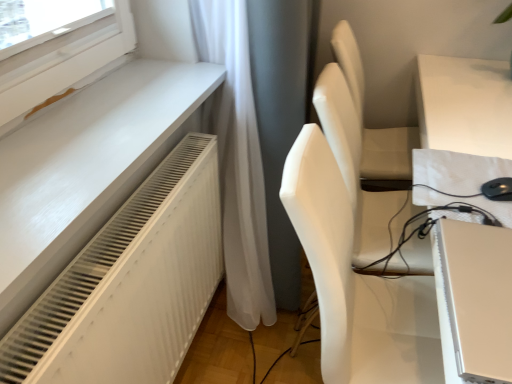
This screenshot has width=512, height=384. What do you see at coordinates (130, 284) in the screenshot?
I see `white textured radiator at lower left` at bounding box center [130, 284].

Where is `satin gold laptop at lower right`? satin gold laptop at lower right is located at coordinates (478, 297).

I want to click on white textured radiator at lower left, so click(130, 284).

Identify the location of computer on the right of the white textured radiator at lower left. The height and width of the screenshot is (384, 512). (478, 297).

From the image's perspective, between satin gold laptop at lower right and white textured radiator at lower left, who is located below?

satin gold laptop at lower right is shown below in the image.

Looking at this image, is satin gold laptop at lower right oriented towards white textured radiator at lower left?

No, satin gold laptop at lower right is not aimed at white textured radiator at lower left.

Is satin gold laptop at lower right not within white textured radiator at lower left?

satin gold laptop at lower right lies outside white textured radiator at lower left's area.

Considering the sizes of objects white textured radiator at lower left and white matte chair at center in the image provided, who is bigger, white textured radiator at lower left or white matte chair at center?

With larger size is white matte chair at center.

Is white textured radiator at lower left located outside white matte chair at center?

white textured radiator at lower left is positioned outside white matte chair at center.

Is white textured radiator at lower left turned away from white matte chair at center?

white textured radiator at lower left is not turned away from white matte chair at center.

At what (x,y) coordinates should I click in order to perform the action: click on radiator in front of the white matte chair at center. Please return your answer as a coordinate pair (x, y). The width and height of the screenshot is (512, 384). Looking at the image, I should click on (130, 284).

How far apart are white matte chair at center and matte white table at right?

white matte chair at center is 23.99 inches away from matte white table at right.

Find the location of a particular element. table beneath the white matte chair at center (from a real-world perspective) is located at coordinates (464, 105).

From the picture: Does white matte chair at center contain matte white table at right?

No, matte white table at right is not surrounded by white matte chair at center.

In the scene shown: Does white matte chair at center have a lesser width compared to matte white table at right?

Yes, white matte chair at center is thinner than matte white table at right.

Does white matte chair at center have a lesser height compared to satin gold laptop at lower right?

Incorrect, the height of white matte chair at center does not fall short of that of satin gold laptop at lower right.

Considering the relative positions of white matte chair at center and satin gold laptop at lower right in the image provided, is white matte chair at center to the left or to the right of satin gold laptop at lower right?

Based on their positions, white matte chair at center is located to the left of satin gold laptop at lower right.

From a real-world perspective, which is physically below, white matte chair at center or satin gold laptop at lower right?

In real-world perspective, white matte chair at center is lower.

The image size is (512, 384). There is a satin gold laptop at lower right. Identify the location of radiator above it (from a real-world perspective). (130, 284).

Is white textured radiator at lower left situated inside satin gold laptop at lower right or outside?

white textured radiator at lower left is spatially situated outside satin gold laptop at lower right.

From the image's perspective, which is above, white textured radiator at lower left or satin gold laptop at lower right?

white textured radiator at lower left, from the image's perspective.

Does white textured radiator at lower left have a greater height compared to satin gold laptop at lower right?

Yes, white textured radiator at lower left is taller than satin gold laptop at lower right.

Looking at their sizes, would you say white textured radiator at lower left is wider or thinner than matte white table at right?

Considering their sizes, white textured radiator at lower left looks slimmer than matte white table at right.

Which of these two, white textured radiator at lower left or matte white table at right, is bigger?

matte white table at right.

The height and width of the screenshot is (384, 512). I want to click on radiator on the left of matte white table at right, so click(x=130, y=284).

Based on their positions, is white textured radiator at lower left located to the left or right of matte white table at right?

white textured radiator at lower left is to the left of matte white table at right.

Consider the image. Which of these two, satin gold laptop at lower right or white matte chair at center, stands shorter?

satin gold laptop at lower right is shorter.

Is satin gold laptop at lower right situated inside white matte chair at center or outside?

satin gold laptop at lower right lies within the bounds of white matte chair at center.

Considering the positions of objects satin gold laptop at lower right and white matte chair at center in the image provided, who is more to the left, satin gold laptop at lower right or white matte chair at center?

white matte chair at center is more to the left.

Is satin gold laptop at lower right positioned before white matte chair at center?

Yes.

Where is `radiator on the left side of satin gold laptop at lower right`? radiator on the left side of satin gold laptop at lower right is located at coordinates (130, 284).

Find the location of a particular element. chair below the white textured radiator at lower left (from the image's perspective) is located at coordinates (356, 282).

From the picture: From the image, which object appears to be farther from satin gold laptop at lower right, white textured radiator at lower left or matte white table at right?

white textured radiator at lower left is positioned further to the anchor satin gold laptop at lower right.

When comparing their distances from matte white table at right, does white textured radiator at lower left or white matte chair at center seem closer?

Based on the image, white matte chair at center appears to be nearer to matte white table at right.

When comparing their distances from matte white table at right, does white matte chair at center or satin gold laptop at lower right seem closer?

The object closer to matte white table at right is white matte chair at center.

From the image, which object appears to be nearer to matte white table at right, white matte chair at center or white textured radiator at lower left?

white matte chair at center.

Looking at the image, which one is located further to white textured radiator at lower left, satin gold laptop at lower right or white matte chair at center?

satin gold laptop at lower right lies further to white textured radiator at lower left than the other object.

From the image, which object appears to be nearer to satin gold laptop at lower right, white matte chair at center or matte white table at right?

white matte chair at center is positioned closer to the anchor satin gold laptop at lower right.

Based on their spatial positions, is satin gold laptop at lower right or white textured radiator at lower left closer to white matte chair at center?

satin gold laptop at lower right is closer to white matte chair at center.

Which object lies nearer to the anchor point white textured radiator at lower left, satin gold laptop at lower right or matte white table at right?

satin gold laptop at lower right is positioned closer to the anchor white textured radiator at lower left.

Image resolution: width=512 pixels, height=384 pixels. In order to click on chair situated between white textured radiator at lower left and satin gold laptop at lower right from left to right in this screenshot , I will do `click(356, 282)`.

Locate an element on the screen. chair located between white textured radiator at lower left and matte white table at right in the left-right direction is located at coordinates (356, 282).

Identify the location of computer between white matte chair at center and matte white table at right from left to right. (478, 297).

This screenshot has height=384, width=512. In order to click on computer between white textured radiator at lower left and matte white table at right in the horizontal direction in this screenshot , I will do `click(478, 297)`.